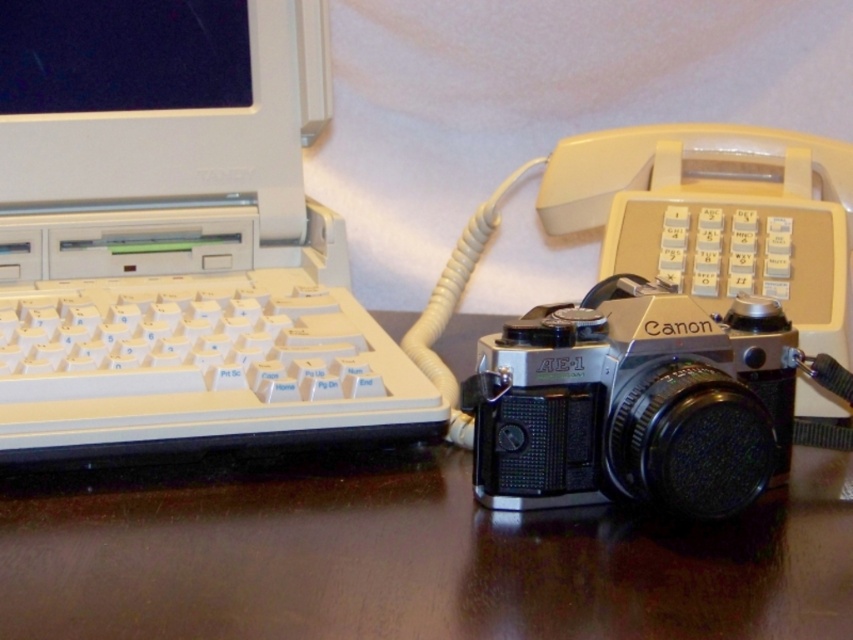
You are organizing the desk in the vintage office scene. You need to place a new mouse between the white plastic laptop at left and the white plastic keyboard at left. Where should you position the mouse relative to the laptop and keyboard?

The white plastic laptop at left is above the white plastic keyboard at left, so you should place the mouse between them either below the laptop or above the keyboard to maintain their vertical arrangement.

Consider the image. You are organizing a tech exhibition and need to place a 15 cm tall sculpture between the white plastic laptop at left and the dark brown wood table at center. Which object should the sculpture be placed closer to, based on their vertical positions?

The white plastic laptop at left is above the dark brown wood table at center, so the sculpture should be placed closer to the dark brown wood table at center to maintain vertical alignment.

You are standing in the vintage office scene and want to place a small notebook on the dark brown wood table at center. However, there is already a silver metallic camera at center on the table. Can the notebook fit on the table without overlapping the camera?

The dark brown wood table at center is in front of the silver metallic camera at center, meaning the camera is placed behind the table. Therefore, there should be enough space on the table to place the notebook without overlapping the camera.